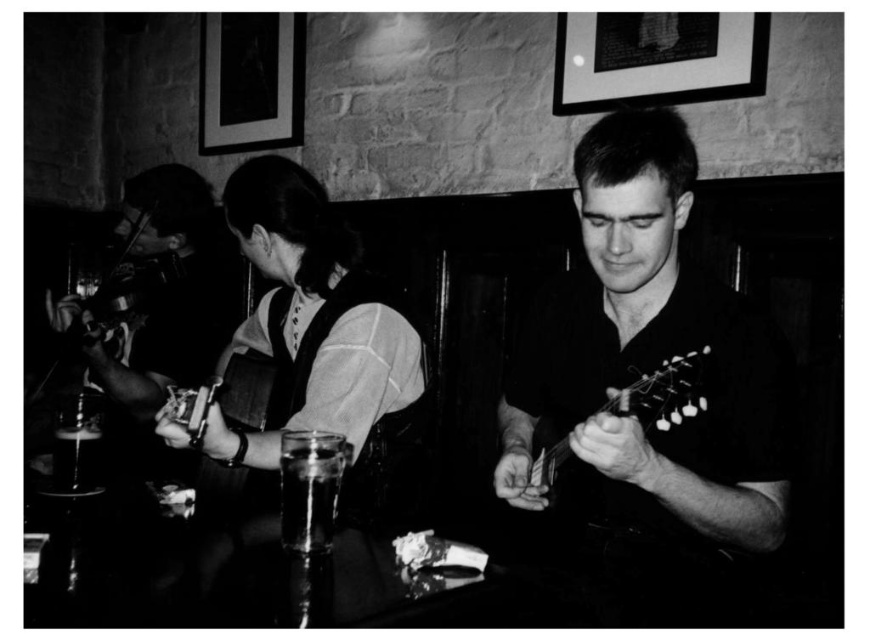
You are a photographer taking a picture of the smooth wood violin at left and the translucent glass at lower left. Which object should you focus on first to ensure both are in clear view?

You should focus on the smooth wood violin at left first because it is closer to the viewer than the translucent glass at lower left, ensuring both are in clear view.

Based on the photo, you are a stagehand setting up equipment for a small performance. The stage is narrow, only 1.5 meters wide. You need to place both the smooth wood violin at left and the metallic silver guitar at center on the stage. Can both fit side by side without overlapping?

The distance between the smooth wood violin at left and the metallic silver guitar at center is 1.32 meters, which is less than the stage width of 1.5 meters. Therefore, both can fit side by side on the stage without overlapping.

You are standing in the pub and want to take a photo of the scene. You notice there is a point at coordinates point (504, 401) that you want to focus on. Given that your camera has a focal length of 50mm and you want the point to be in sharp focus, what is the minimum distance you should be from the scene?

The point at coordinates point (504, 401) is 4.87 feet away from the viewer. To ensure sharp focus, you should position yourself at least 4.87 feet away from the scene.